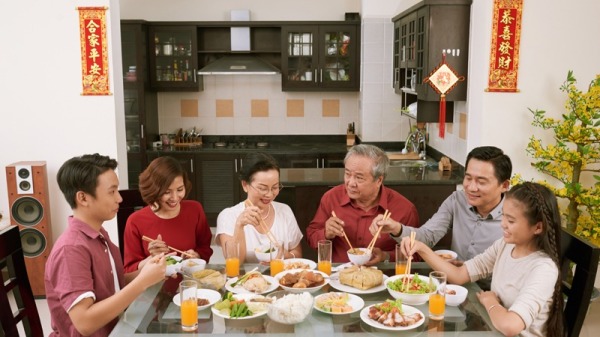
Identify the location of audio speaker. This screenshot has width=600, height=337. (39, 196).